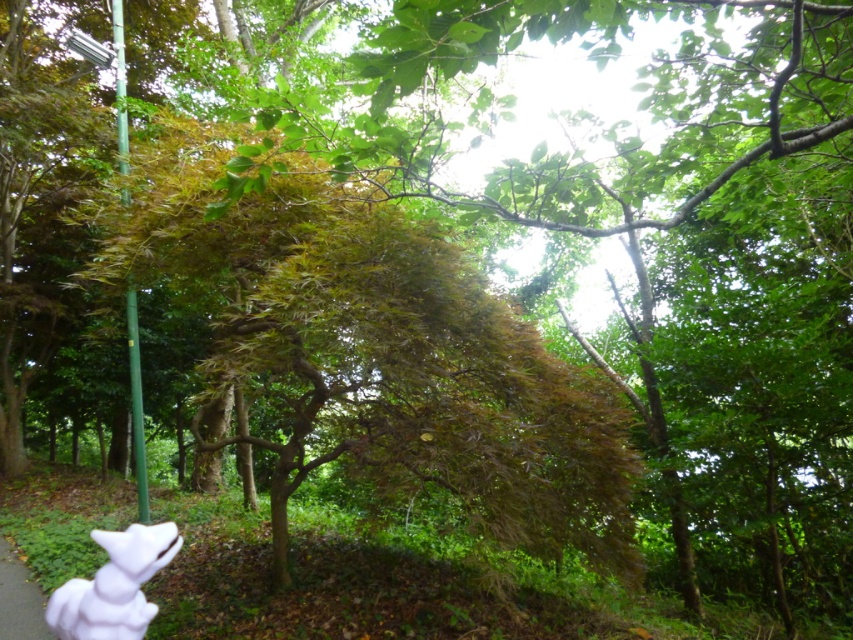
Question: Which object is closer to the camera taking this photo?

Choices:
 (A) white matte fox at lower left
 (B) green grass at lower left

Answer: (A)

Question: Is white matte fox at lower left in front of green grass at lower left?

Choices:
 (A) yes
 (B) no

Answer: (A)

Question: Is white matte fox at lower left thinner than green grass at lower left?

Choices:
 (A) no
 (B) yes

Answer: (B)

Question: Which point is farther to the camera?

Choices:
 (A) white matte fox at lower left
 (B) green grass at lower left

Answer: (B)

Question: Can you confirm if white matte fox at lower left is positioned to the left of green grass at lower left?

Choices:
 (A) no
 (B) yes

Answer: (A)

Question: Which of the following is the farthest from the observer?

Choices:
 (A) (22, 621)
 (B) (62, 605)

Answer: (A)